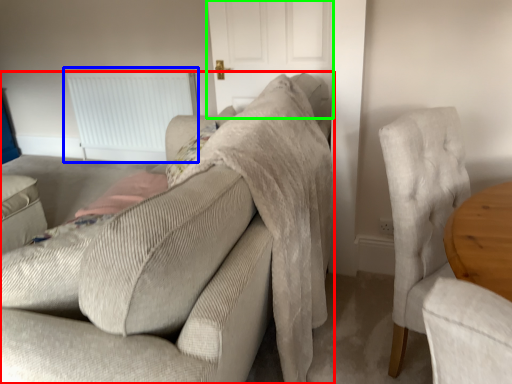
Question: Based on their relative distances, which object is farther from studio couch (highlighted by a red box)? Choose from radiator (highlighted by a blue box) and door (highlighted by a green box).

Choices:
 (A) radiator
 (B) door

Answer: (A)